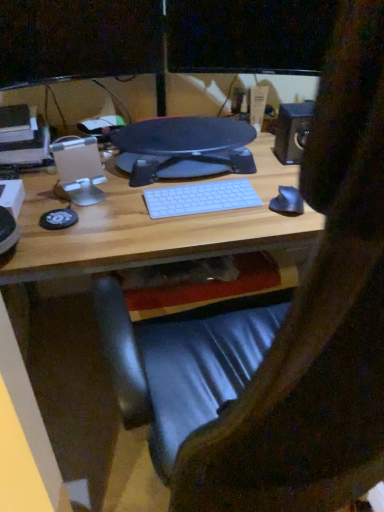
In order to click on free space in front of glossy black monitor at center in this screenshot , I will do `click(159, 221)`.